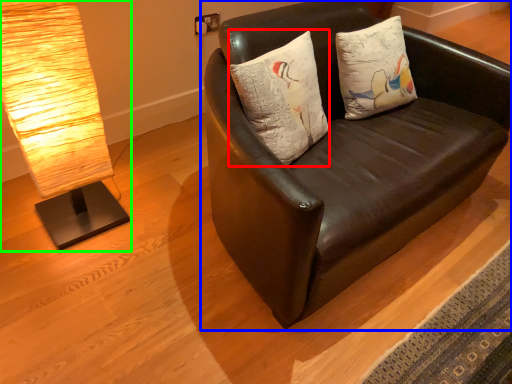
Question: Which is nearer to the pillow (highlighted by a red box)? studio couch (highlighted by a blue box) or lamp (highlighted by a green box).

Choices:
 (A) studio couch
 (B) lamp

Answer: (A)